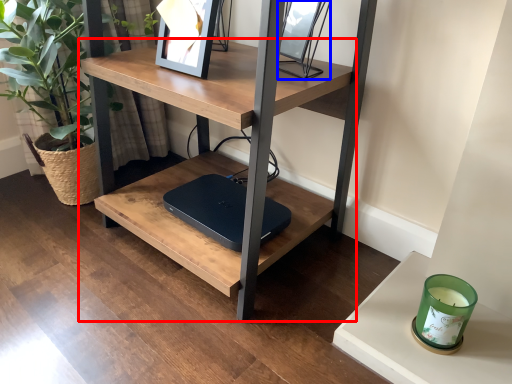
Question: Which point is further to the camera, table (highlighted by a red box) or picture frame (highlighted by a blue box)?

Choices:
 (A) table
 (B) picture frame

Answer: (B)